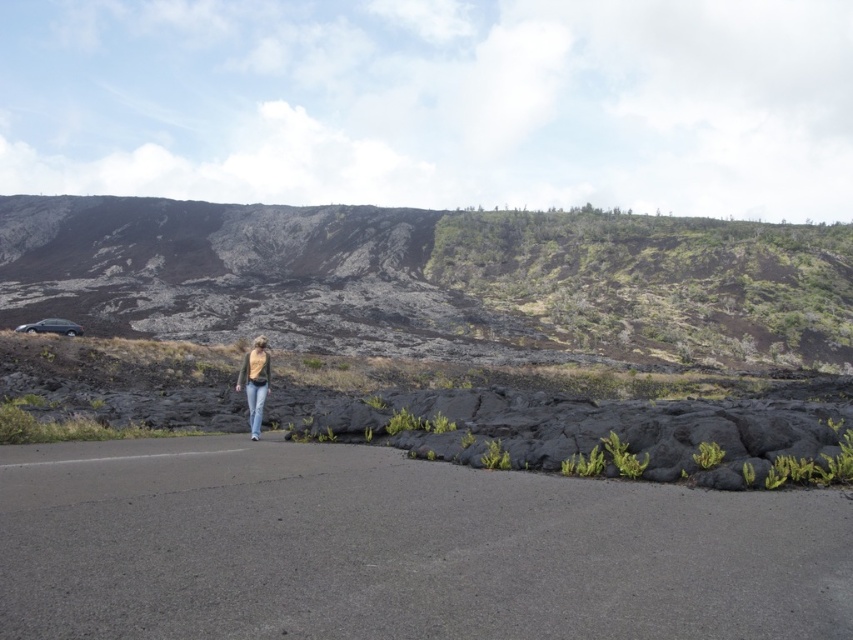
Question: Is asphalt road at center closer to camera compared to volcanic rock at upper left?

Choices:
 (A) yes
 (B) no

Answer: (A)

Question: Is asphalt road at center positioned behind shiny silver car at lower left?

Choices:
 (A) yes
 (B) no

Answer: (B)

Question: Which point is closer to the camera taking this photo?

Choices:
 (A) (254, 244)
 (B) (250, 548)
 (C) (242, 360)
 (D) (262, 388)

Answer: (B)

Question: Which object is farther from the camera taking this photo?

Choices:
 (A) asphalt road at center
 (B) volcanic rock at upper left
 (C) denim pants at center
 (D) denim at center

Answer: (B)

Question: Is asphalt road at center bigger than denim pants at center?

Choices:
 (A) yes
 (B) no

Answer: (B)

Question: Which point is farther to the camera?

Choices:
 (A) volcanic rock at upper left
 (B) denim at center
 (C) denim pants at center

Answer: (A)